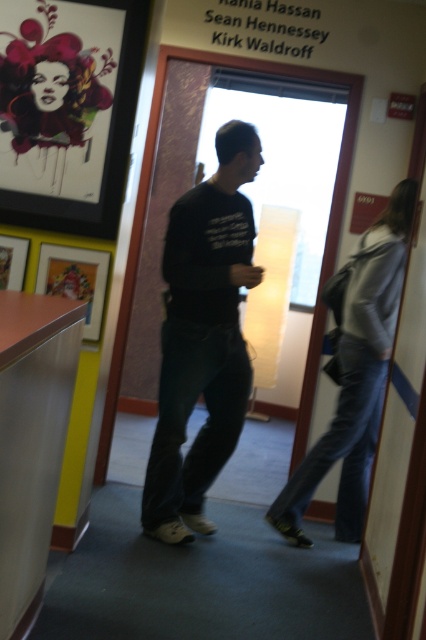
Question: Which of the following is the farthest from the observer?

Choices:
 (A) (66, 317)
 (B) (75, 102)
 (C) (238, 435)

Answer: (C)

Question: Can you confirm if black matte shirt at center is wider than denim jacket at right?

Choices:
 (A) no
 (B) yes

Answer: (A)

Question: Is metallic silver desk at lower left positioned behind denim jacket at right?

Choices:
 (A) yes
 (B) no

Answer: (B)

Question: Based on their relative distances, which object is nearer to the black matte shirt at center?

Choices:
 (A) painted paper portrait at upper left
 (B) metallic silver desk at lower left
 (C) denim jacket at right

Answer: (C)

Question: Which point is farther to the camera?

Choices:
 (A) black matte shirt at center
 (B) denim jacket at right
 (C) metallic silver desk at lower left
 (D) painted paper portrait at upper left

Answer: (B)

Question: Is black matte shirt at center smaller than painted paper portrait at upper left?

Choices:
 (A) no
 (B) yes

Answer: (A)